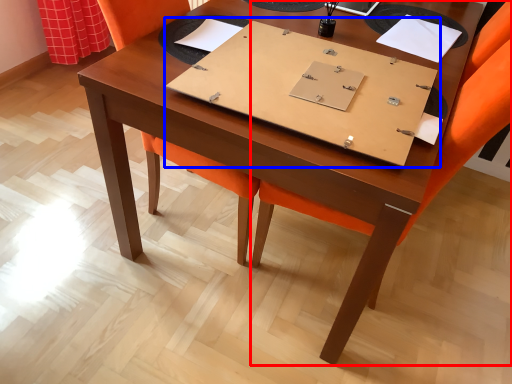
Question: Which object is closer to the camera taking this photo, chair (highlighted by a red box) or notebook (highlighted by a blue box)?

Choices:
 (A) chair
 (B) notebook

Answer: (A)